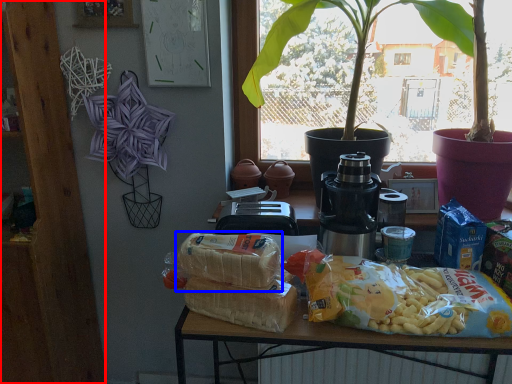
Question: Among these objects, which one is farthest to the camera, bookshelf (highlighted by a red box) or yoghurt (highlighted by a blue box)?

Choices:
 (A) bookshelf
 (B) yoghurt

Answer: (A)